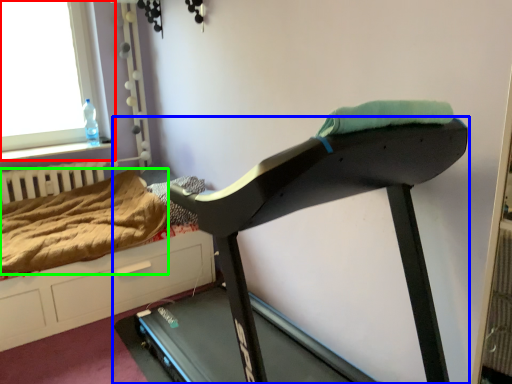
Question: Which object is positioned farthest from window (highlighted by a red box)? Select from treadmill (highlighted by a blue box) and blanket (highlighted by a green box).

Choices:
 (A) treadmill
 (B) blanket

Answer: (A)